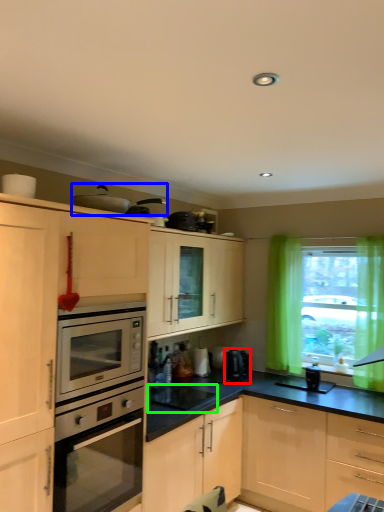
Question: Considering the real-world distances, which object is farthest from coffee machine (highlighted by a red box)? appliance (highlighted by a blue box) or appliance (highlighted by a green box)?

Choices:
 (A) appliance
 (B) appliance

Answer: (A)